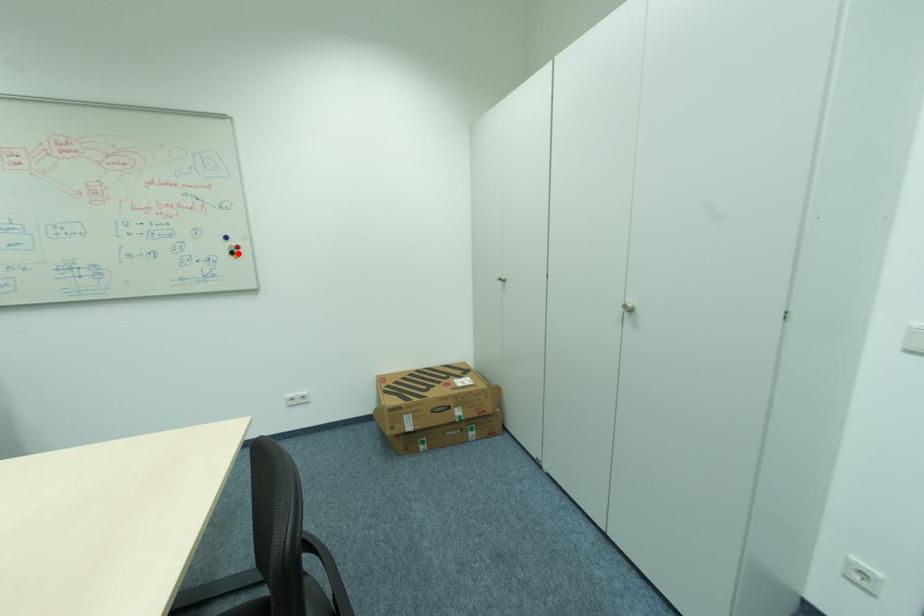
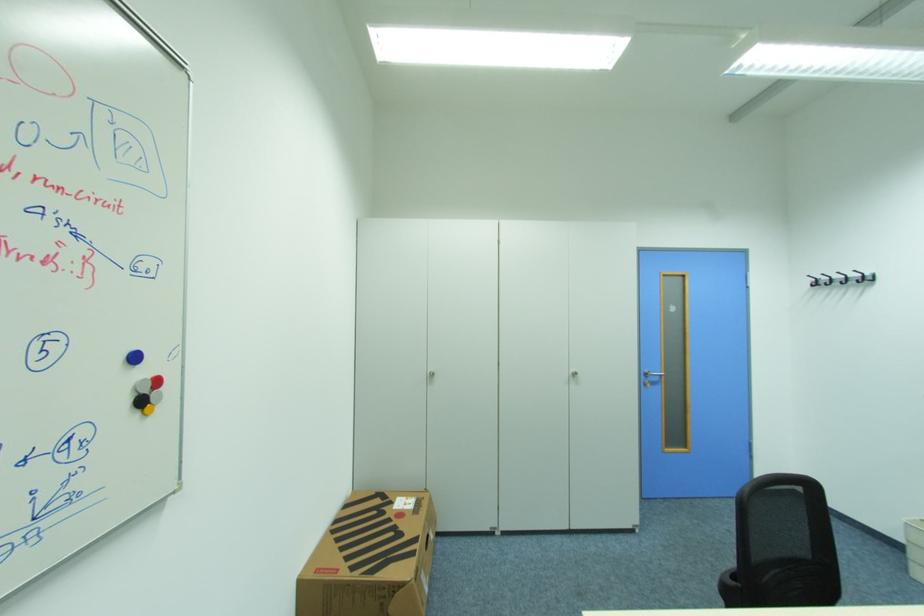
Find the pixel in the second image that matches the highlighted location in the first image.

(146, 403)